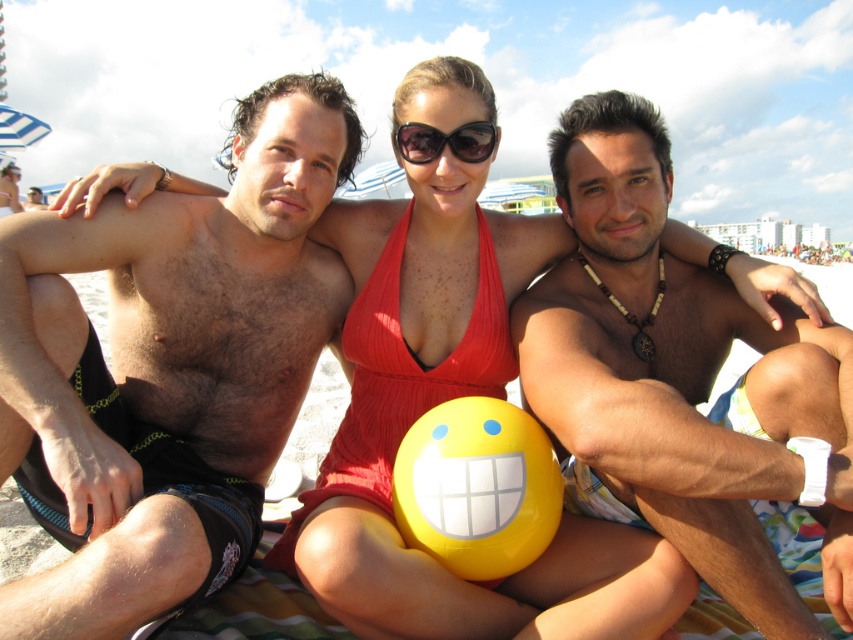
Looking at this image, what is the exact coordinate of the smooth tan skin at center?

The smooth tan skin at center is located at point (674, 372).